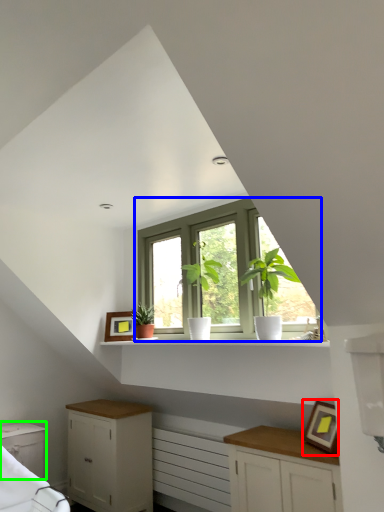
Question: Considering the real-world distances, which object is farthest from picture frame (highlighted by a red box)? window (highlighted by a blue box) or cabinetry (highlighted by a green box)?

Choices:
 (A) window
 (B) cabinetry

Answer: (B)